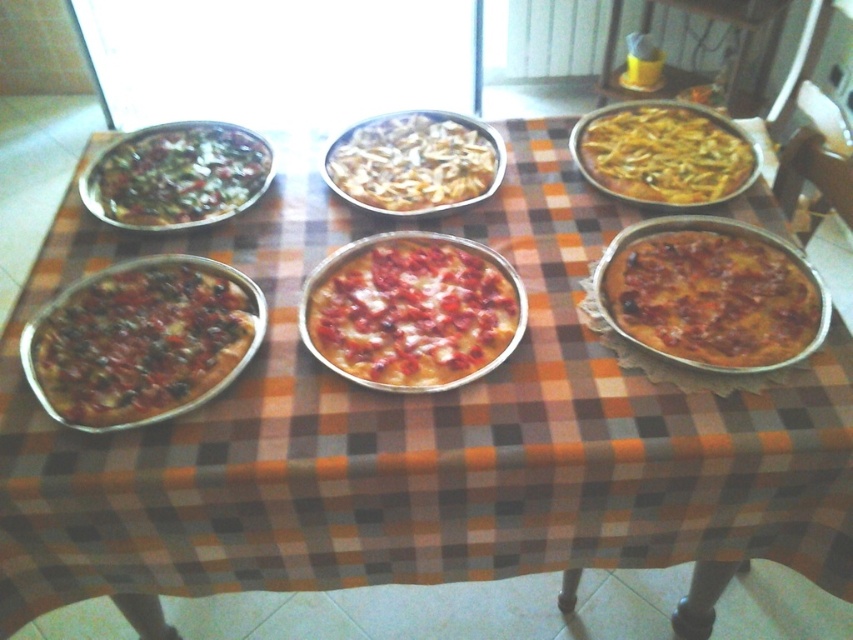
Who is lower down, green leafy pizza at upper left or yellow cheese pizza at upper right?

Positioned lower is green leafy pizza at upper left.

Between green leafy pizza at upper left and yellow cheese pizza at upper right, which one is positioned higher?

yellow cheese pizza at upper right is higher up.

Who is more forward, (183, 208) or (699, 131)?

Positioned in front is point (183, 208).

Find the location of a particular element. The width and height of the screenshot is (853, 640). green leafy pizza at upper left is located at coordinates (177, 176).

Does golden brown crusty pizza at center right appear under cheesy white pizza at center?

Yes, golden brown crusty pizza at center right is below cheesy white pizza at center.

Between golden brown crusty pizza at center right and cheesy white pizza at center, which one has less height?

Standing shorter between the two is golden brown crusty pizza at center right.

Does point (616, 257) come in front of point (343, 172)?

That is True.

This screenshot has width=853, height=640. I want to click on golden brown crusty pizza at center right, so click(712, 298).

Between dark brown crusty pizza at left and yellow cheese pizza at upper right, which one appears on the left side from the viewer's perspective?

From the viewer's perspective, dark brown crusty pizza at left appears more on the left side.

Which is above, dark brown crusty pizza at left or yellow cheese pizza at upper right?

yellow cheese pizza at upper right

The image size is (853, 640). What do you see at coordinates (142, 340) in the screenshot?
I see `dark brown crusty pizza at left` at bounding box center [142, 340].

Locate an element on the screen. dark brown crusty pizza at left is located at coordinates (142, 340).